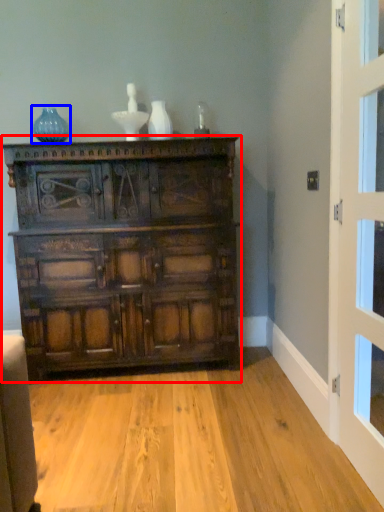
Question: Which point is closer to the camera, chest of drawers (highlighted by a red box) or vase (highlighted by a blue box)?

Choices:
 (A) chest of drawers
 (B) vase

Answer: (A)